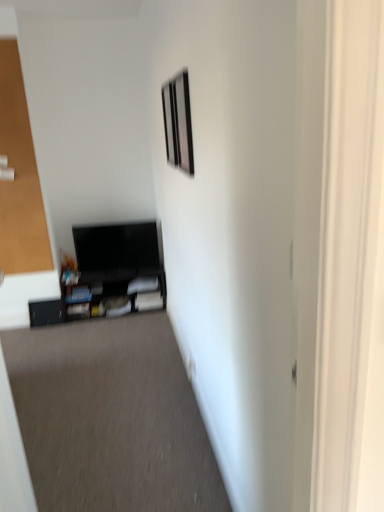
Question: Based on their positions, is transparent glass door at left located to the left or right of black cardboard box at lower left?

Choices:
 (A) left
 (B) right

Answer: (A)

Question: Is transparent glass door at left inside the boundaries of black cardboard box at lower left, or outside?

Choices:
 (A) inside
 (B) outside

Answer: (B)

Question: Estimate the real-world distances between objects in this image. Which object is closer to the matte black entertainment center at lower left?

Choices:
 (A) metallic silver picture frame at upper center, which is counted as the first picture frame, starting from the right
 (B) matte black picture frame at upper center, the 1th picture frame from the back
 (C) black cardboard box at lower left
 (D) transparent glass door at left

Answer: (D)

Question: Which object is the farthest from the metallic silver picture frame at upper center, marked as the 2th picture frame in a left-to-right arrangement?

Choices:
 (A) matte black entertainment center at lower left
 (B) transparent glass door at left
 (C) matte black picture frame at upper center, the 1th picture frame from the back
 (D) black cardboard box at lower left

Answer: (B)